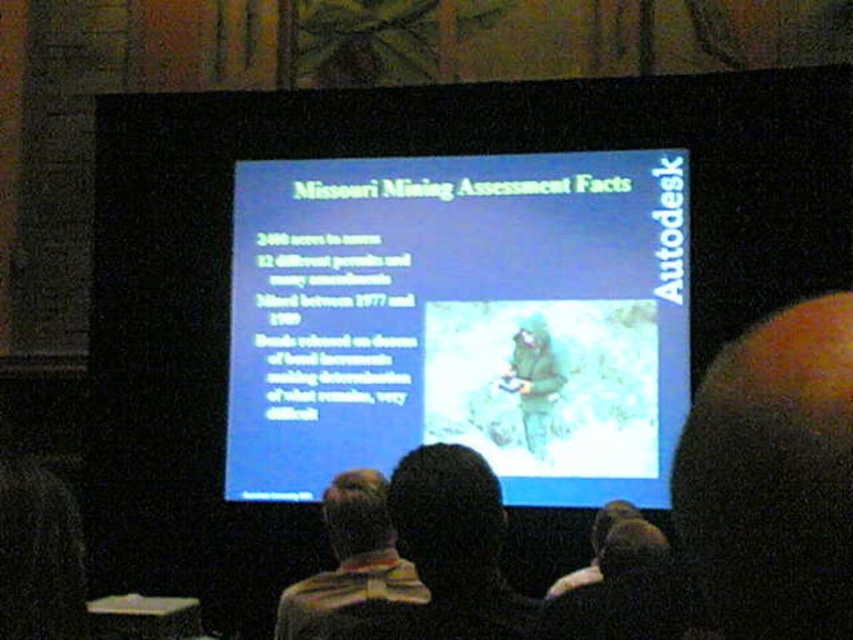
You are an attendee in the conference room and want to see the striped shirt at center clearly. Can you see it without obstruction from the dark brown hair at upper right?

The striped shirt at center is behind dark brown hair at upper right, so the dark brown hair at upper right is blocking the view of the striped shirt at center. Therefore, you cannot see the striped shirt at center clearly without obstruction.